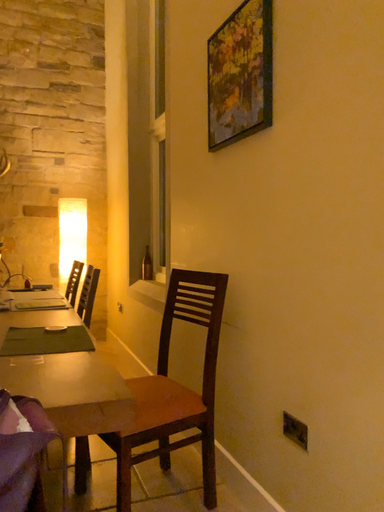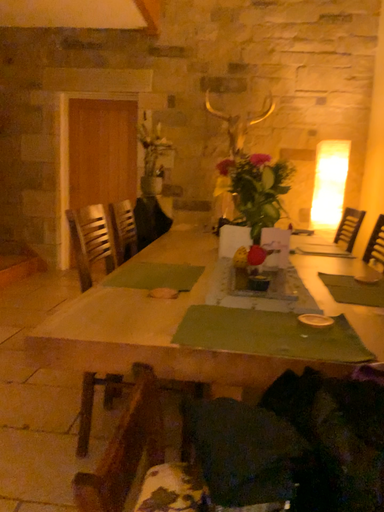
Question: Which way did the camera rotate in the video?

Choices:
 (A) rotated downward
 (B) rotated upward

Answer: (A)